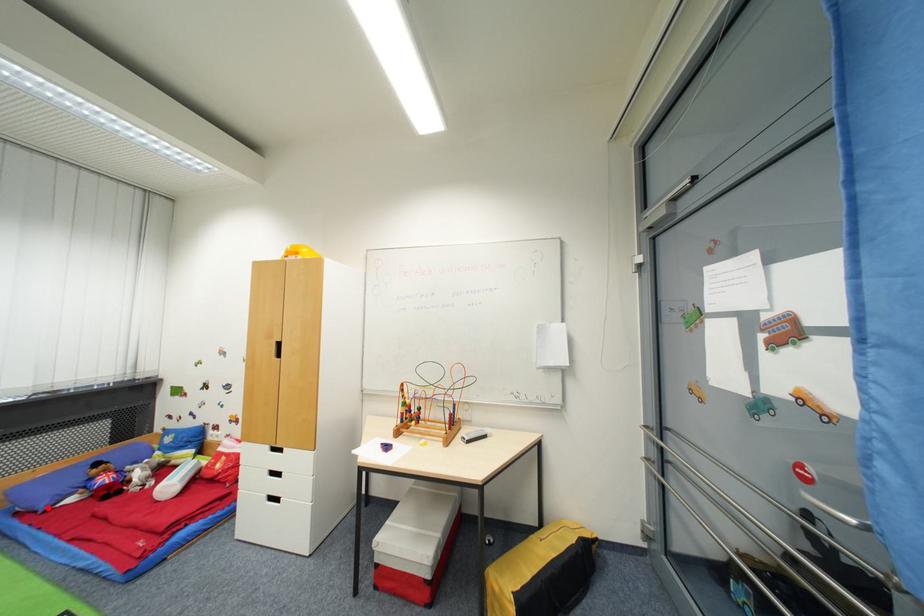
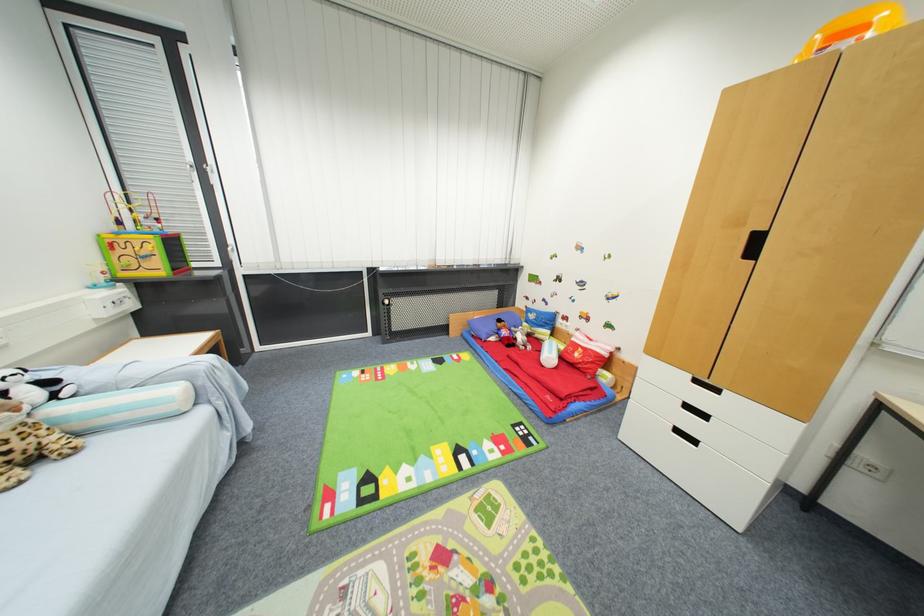
Question: I am providing you with two images of the same scene from different viewpoints. A red point is marked on the first image. At the location where the point appears in image 1, is it still visible in image 2?

Choices:
 (A) Yes
 (B) No

Answer: (A)